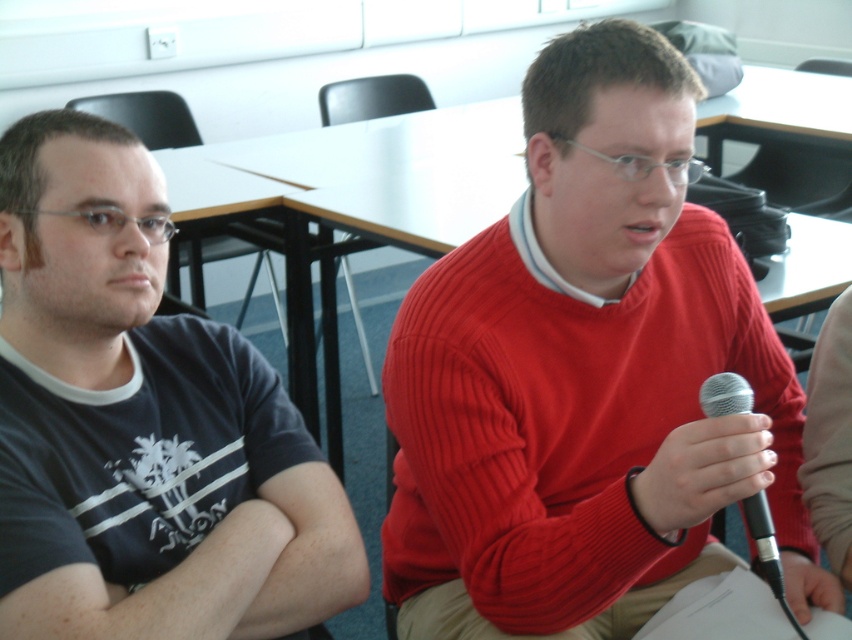
Question: Which object is closer to the camera taking this photo?

Choices:
 (A) dark blue t-shirt at left
 (B) red ribbed sweater at center
 (C) silver metallic microphone at center

Answer: (A)

Question: Can you confirm if red ribbed sweater at center is bigger than silver metallic microphone at center?

Choices:
 (A) no
 (B) yes

Answer: (B)

Question: Does dark blue t-shirt at left appear on the left side of silver metallic microphone at center?

Choices:
 (A) no
 (B) yes

Answer: (B)

Question: In this image, where is red ribbed sweater at center located relative to silver metallic microphone at center?

Choices:
 (A) left
 (B) right

Answer: (A)

Question: Which object is the farthest from the silver metallic microphone at center?

Choices:
 (A) red ribbed sweater at center
 (B) dark blue t-shirt at left

Answer: (B)

Question: Which is farther from the dark blue t-shirt at left?

Choices:
 (A) silver metallic microphone at center
 (B) red ribbed sweater at center

Answer: (A)